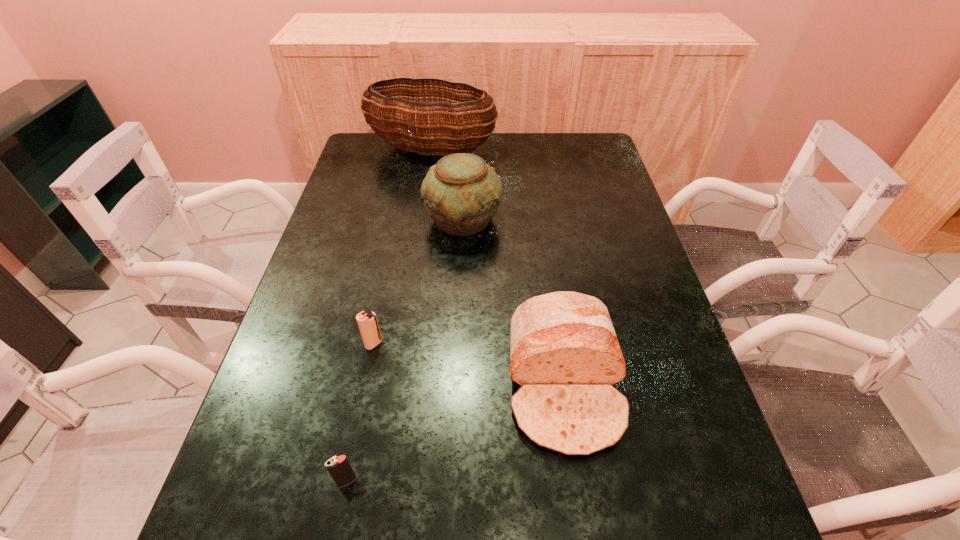
Find the location of a particular element. This screenshot has width=960, height=540. free space located 0.200m on the back of the nearest object is located at coordinates (369, 375).

What are the coordinates of `object at the far edge` in the screenshot? It's located at (424, 120).

Locate an element on the screen. Image resolution: width=960 pixels, height=540 pixels. object situated at the left edge is located at coordinates (424, 120).

Find the location of a particular element. The height and width of the screenshot is (540, 960). object positioned at the right edge is located at coordinates (565, 354).

I want to click on object located in the far left corner section of the desktop, so coord(424,120).

The width and height of the screenshot is (960, 540). I want to click on free location at the far edge, so click(522, 138).

Image resolution: width=960 pixels, height=540 pixels. What are the coordinates of `free space at the left edge of the desktop` in the screenshot? It's located at (339, 267).

At what (x,y) coordinates should I click in order to perform the action: click on blank area at the right edge. Please return your answer as a coordinate pair (x, y). Looking at the image, I should click on (619, 303).

In the image, there is a desktop. In order to click on vacant region at the far left corner in this screenshot , I will do `click(373, 143)`.

Where is `unoccupied area between the basket and the farther igniter`? unoccupied area between the basket and the farther igniter is located at coordinates (403, 247).